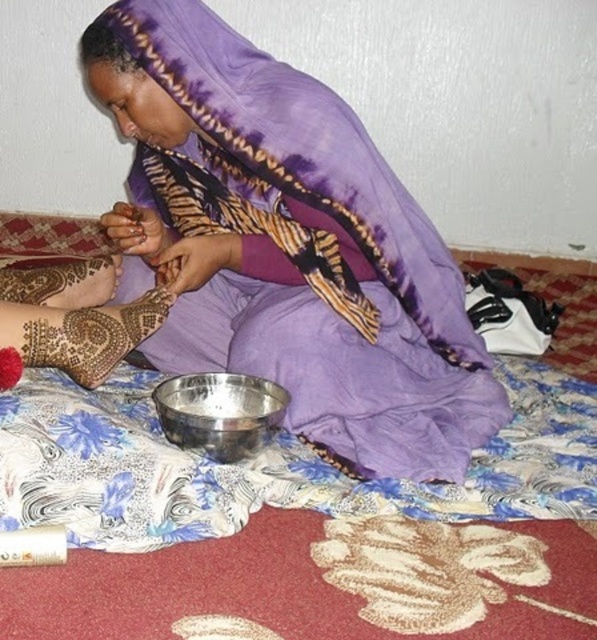
You are standing 1.5 meters away from the camera. Can you reach the point at coordinates point (165,504) with your hand?

The point at coordinates point (165,504) is 1.12 meters away from the camera. Since you are standing 1.5 meters away from the camera, you are farther than the point, so you cannot reach it with your hand.

You are a guest at a cultural event and see the metallic silver bowl at center and the purple satin scarf at upper center. Which object is shorter in height?

The metallic silver bowl at center has a lesser height compared to the purple satin scarf at upper center, so the metallic silver bowl at center is shorter.

You are a photographer taking a picture of the scene. The metallic silver bowl at center is located at point coordinates of (296, 522). If you want to ensure the bowl is centered in your photo, where should you aim your camera? Please provide the coordinates as a point in the format of point followed by the coordinates in parentheses.

The metallic silver bowl at center is already at point coordinates of (296, 522), so aiming the camera at that point will center the bowl in the photo.